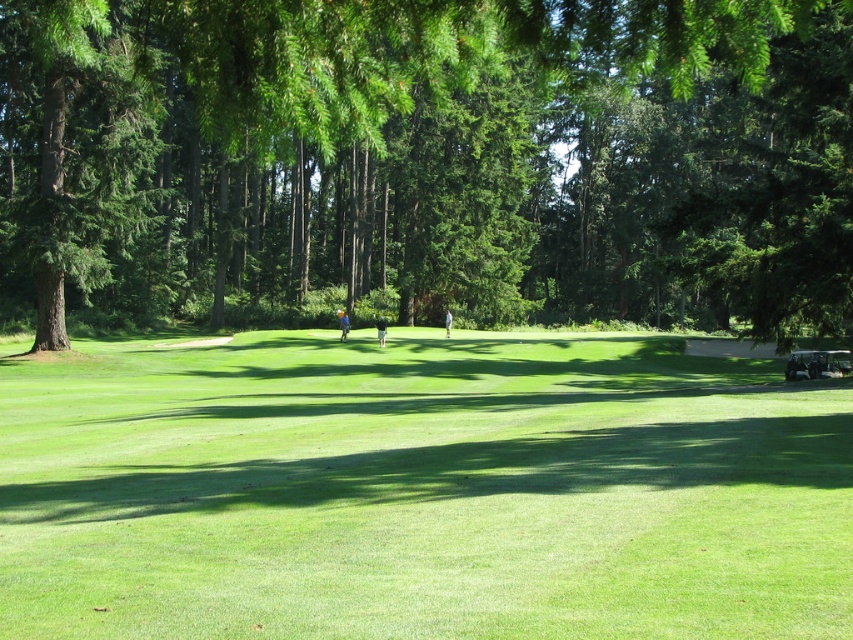
You are a golfer standing on the green grassy field at center and want to take a photo of the green leafy tree at center. Since both are in the center, how can you position yourself to ensure the tree is fully in the frame?

The green leafy tree at center is bigger than the green grassy field at center, so you should move back to ensure the entire tree fits within your camera frame.

You are standing at the center of the golf course and see the green leafy tree at center. Based on its coordinates, is the tree located to the left or right of the center point of the image?

The green leafy tree at center is located at coordinates point (427, 160), which places it slightly to the left of the center point of the image.

You are a golfer standing on the green grassy field at center. Looking towards the green leafy tree at center, which object is taller?

The green leafy tree at center is taller than the green grassy field at center.